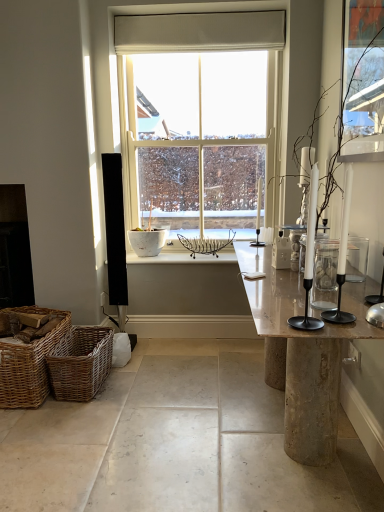
You are a GUI agent. You are given a task and a screenshot of the screen. Output one action in this format:
    pyautogui.click(x=<x>, y=<y>)
    Task: Click on the free space that is in between marble table at center and woven brown picnic basket at lower left, which is counted as the second picnic basket, starting from the left
    Image resolution: width=384 pixels, height=512 pixels.
    Given the screenshot: What is the action you would take?
    pyautogui.click(x=170, y=413)